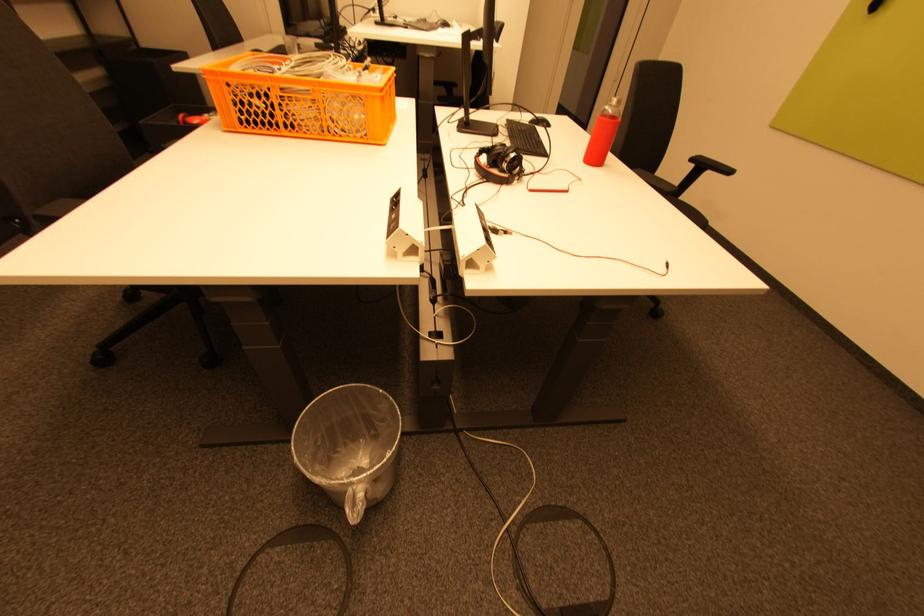
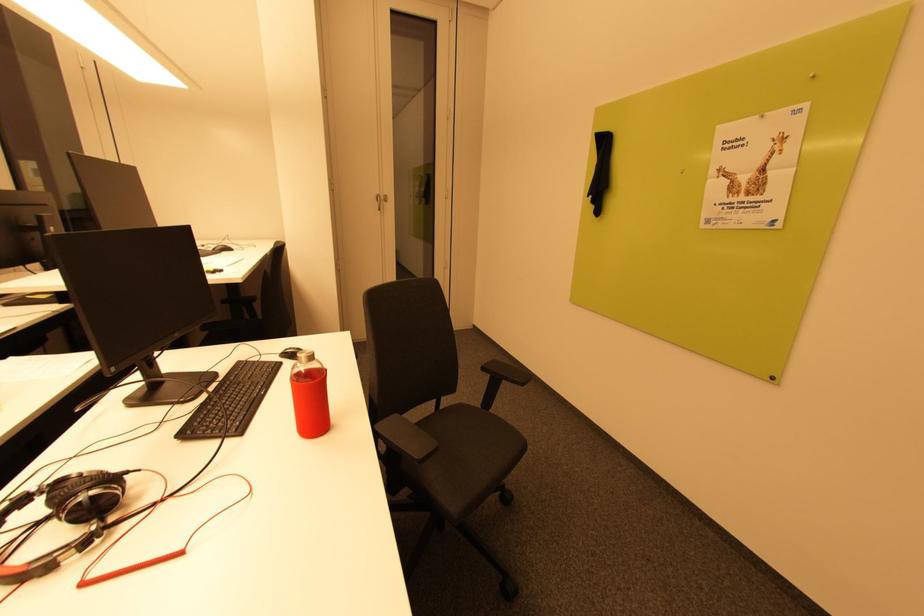
In the scene shown: The images are taken continuously from a first-person perspective. In which direction is your viewpoint rotating?

The rotation direction of the camera is right-up.